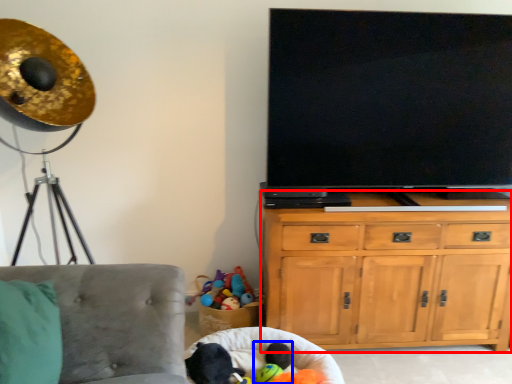
Question: Among these objects, which one is nearest to the camera, cabinetry (highlighted by a red box) or toy (highlighted by a blue box)?

Choices:
 (A) cabinetry
 (B) toy

Answer: (B)